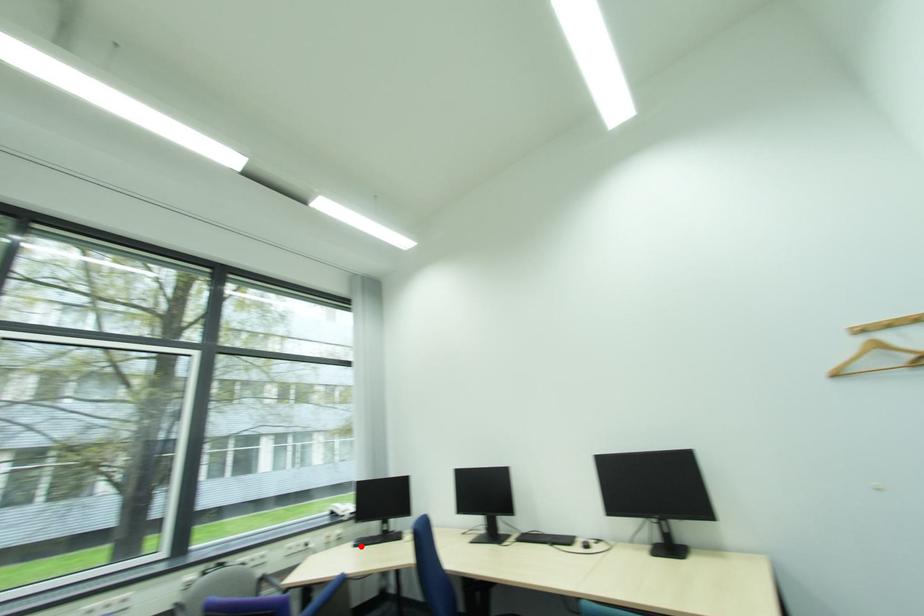
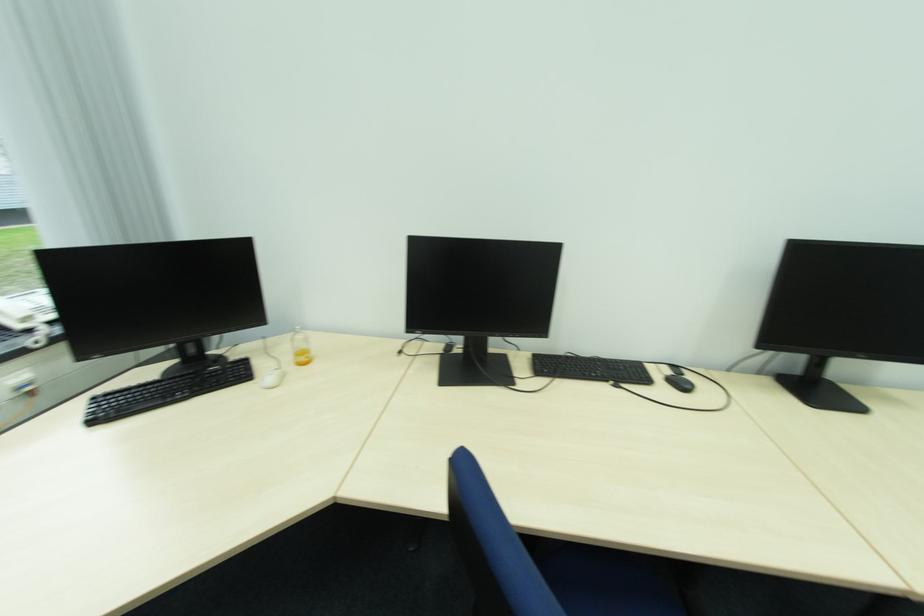
The point at the highlighted location is marked in the first image. Where is the corresponding point in the second image?

(100, 422)